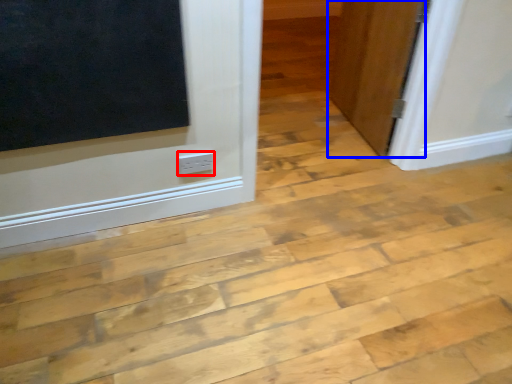
Question: Which of the following is the closest to the observer, electric outlet (highlighted by a red box) or door (highlighted by a blue box)?

Choices:
 (A) electric outlet
 (B) door

Answer: (A)